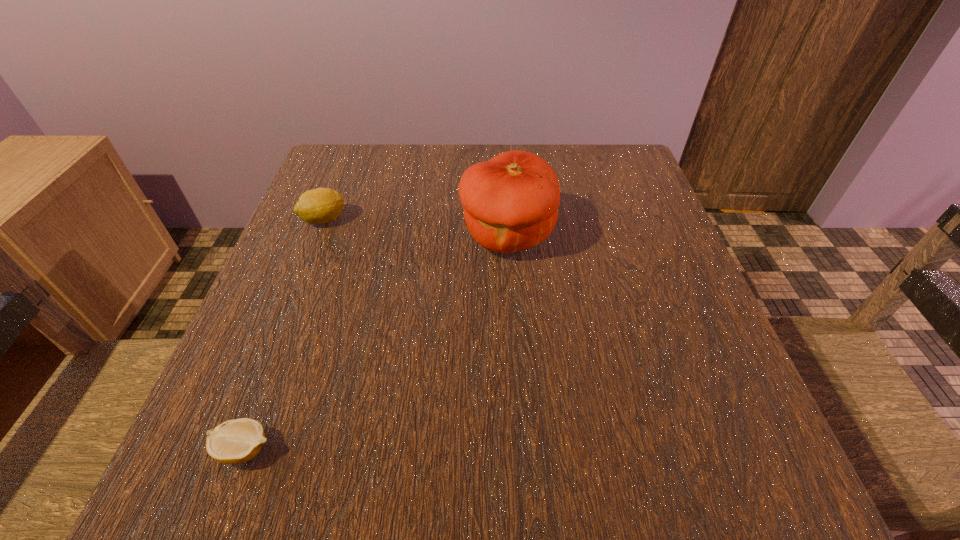
Where is `the tallest object`? Image resolution: width=960 pixels, height=540 pixels. the tallest object is located at coordinates (510, 203).

You are a GUI agent. You are given a task and a screenshot of the screen. Output one action in this format:
    pyautogui.click(x=<x>, y=<y>)
    Task: Click on the rightmost object
    This screenshot has height=540, width=960.
    Given the screenshot: What is the action you would take?
    pyautogui.click(x=510, y=203)

Locate an element on the screen. The width and height of the screenshot is (960, 540). the farther lemon is located at coordinates (321, 205).

Identify the location of the taller lemon. (321, 205).

The height and width of the screenshot is (540, 960). Identify the location of the shortest object. (237, 441).

Find the location of a particular element. This screenshot has height=540, width=960. the shorter lemon is located at coordinates 237,441.

Where is `vacant region located 0.150m on the right of the tallest object`? vacant region located 0.150m on the right of the tallest object is located at coordinates (625, 235).

Identify the location of vacant point located 0.290m at the stem end of the taller lemon. (480, 220).

Find the location of a particular element. free space located 0.290m on the back of the shorter lemon is located at coordinates (307, 281).

The image size is (960, 540). I want to click on object present at the near edge, so click(x=237, y=441).